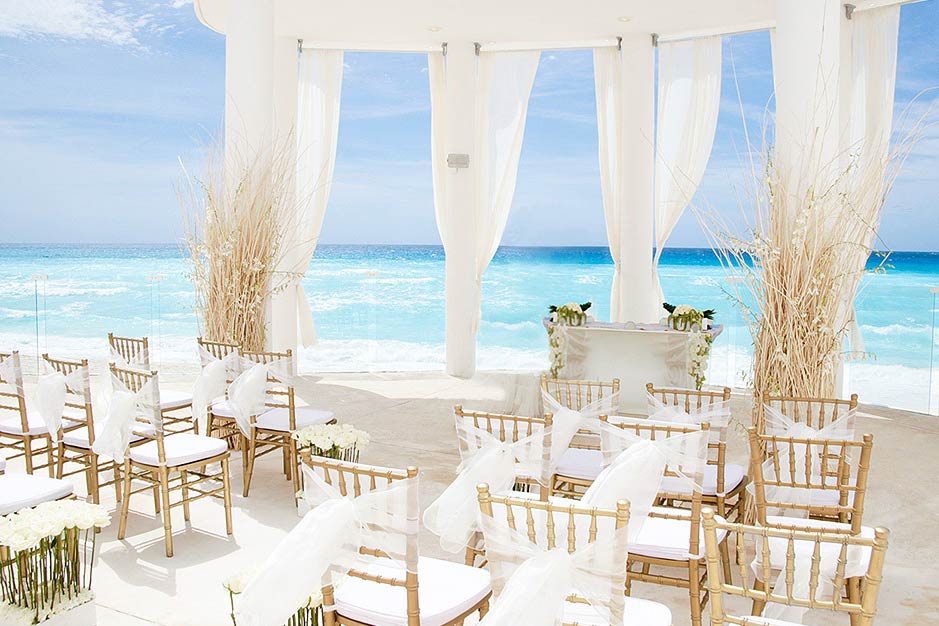
Identify the location of chairs. The height and width of the screenshot is (626, 939). (735, 595), (594, 576).